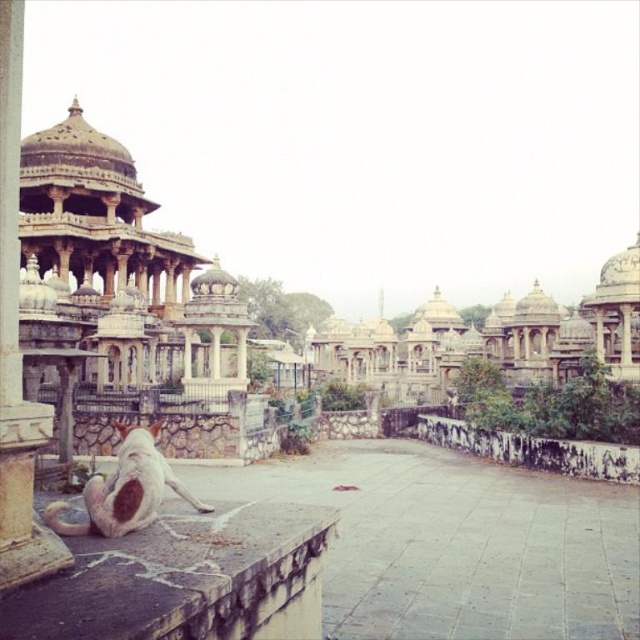
Question: Among these points, which one is farthest from the camera?

Choices:
 (A) (461, 348)
 (B) (116, 324)
 (C) (19, 140)
 (D) (280, 612)

Answer: (A)

Question: Which object appears farthest from the camera in this image?

Choices:
 (A) gray stone ledge at lower left
 (B) polished stone pillar at left
 (C) white stone palace at left
 (D) white stone palaces at center

Answer: (D)

Question: Can you confirm if white stone palace at left is bigger than white stone palaces at center?

Choices:
 (A) no
 (B) yes

Answer: (A)

Question: Can you confirm if white stone palace at left is thinner than white stone palaces at center?

Choices:
 (A) yes
 (B) no

Answer: (A)

Question: Considering the relative positions of white stone palace at left and white stone palaces at center in the image provided, where is white stone palace at left located with respect to white stone palaces at center?

Choices:
 (A) left
 (B) right

Answer: (A)

Question: Which point is closer to the camera taking this photo?

Choices:
 (A) (529, 364)
 (B) (246, 336)

Answer: (B)